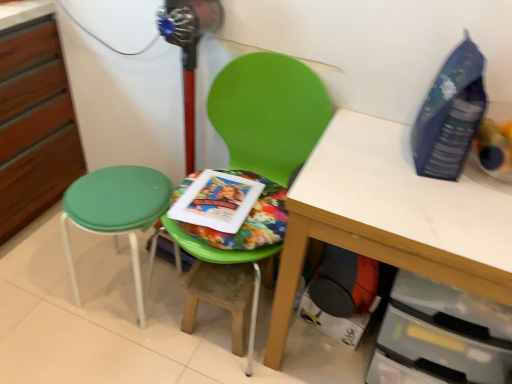
Locate an element on the screen. free spot in front of green fabric stool at left is located at coordinates click(100, 352).